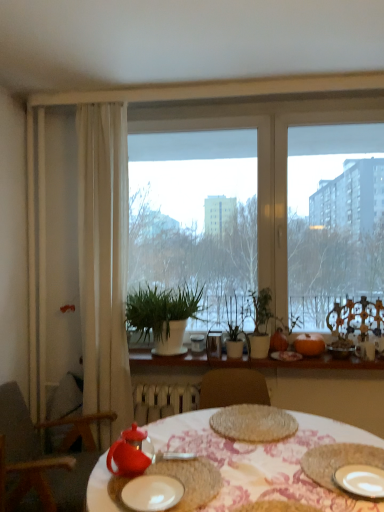
This screenshot has height=512, width=384. I want to click on free space above white ceramic plate at lower right, placed as the first plate when sorted from right to left (from a real-world perspective), so click(365, 478).